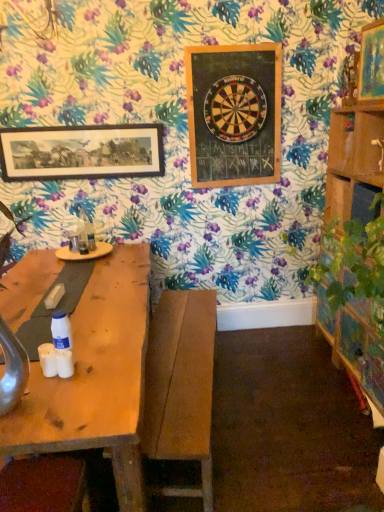
Identify the location of free space above velvet brown cushion at lower left, which appears as the first swivel chair when viewed from the left (from a real-world perspective). This screenshot has height=512, width=384. (37, 483).